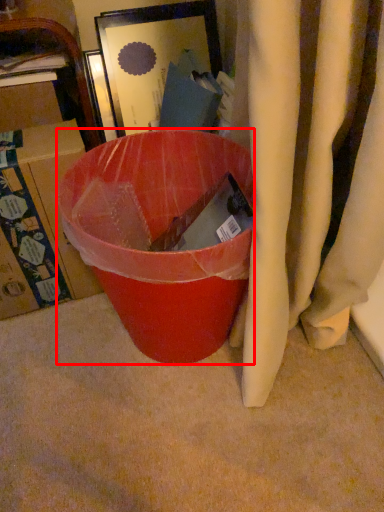
Question: Considering the relative positions of trash bin/can (annotated by the red box) and box in the image provided, where is trash bin/can (annotated by the red box) located with respect to the staircase?

Choices:
 (A) left
 (B) right

Answer: (B)